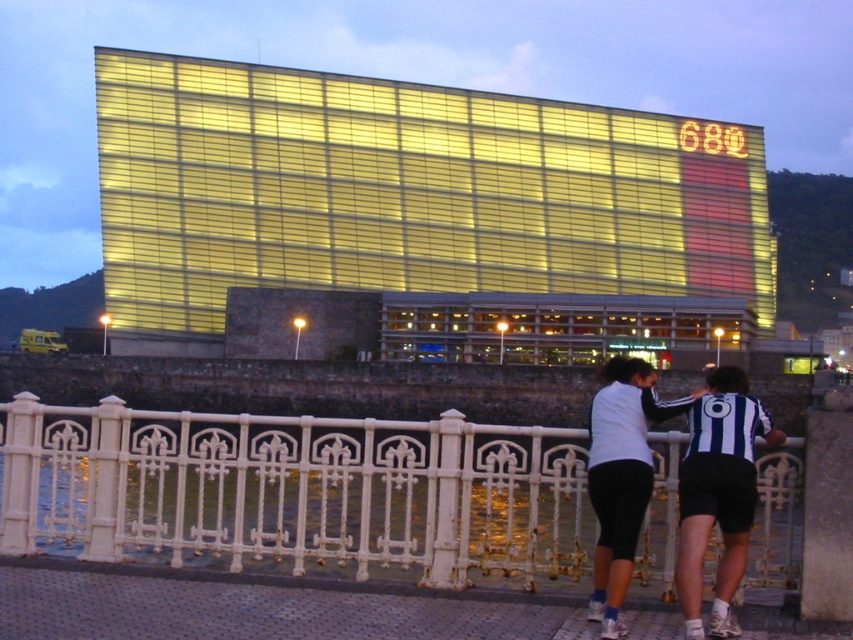
You are standing on the walkway in front of the building and see two points marked on the railing. The first point is at coordinate point (489, 541) and the second point is at coordinate point (747, 528). Which point is closer to you?

Point (489, 541) is closer to you because it is further to the viewer than point (747, 528).

You are standing at the point marked as point (296, 490) in the image of the modern building. What object are you most likely standing next to?

The point (296, 490) corresponds to the white wrought iron fence at lower center, so you are most likely standing next to the white wrought iron fence at lower center.